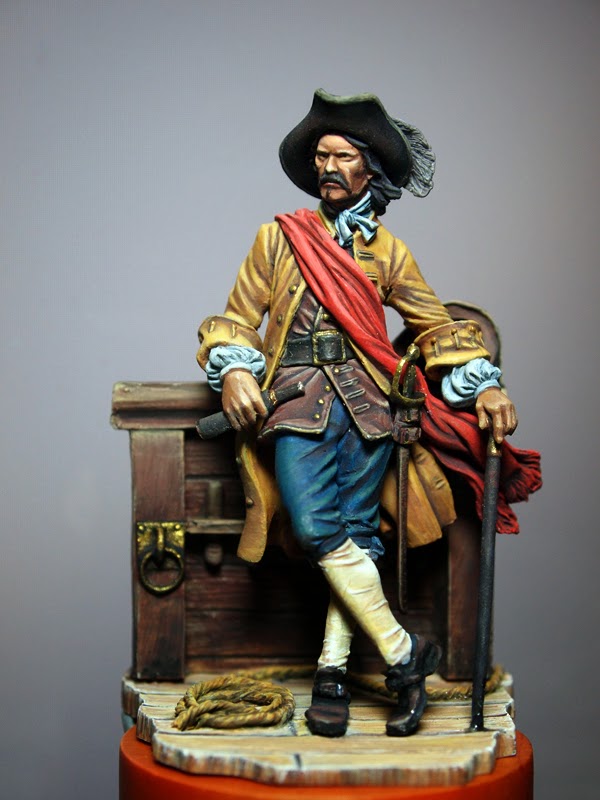
Identify the location of lock. (160, 541).